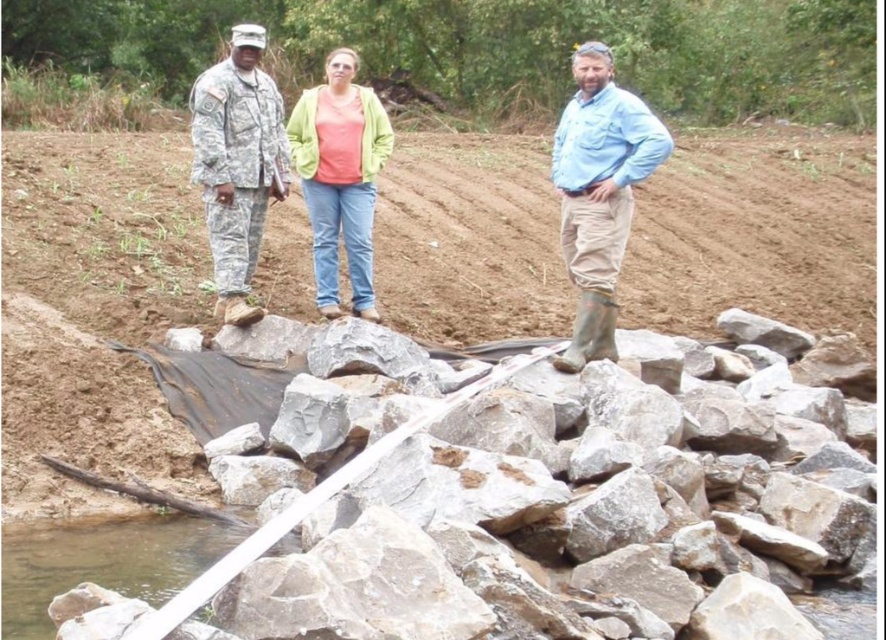
You are a construction worker standing at the edge of the construction site. You need to place a heavy tool on the closest object to you between the gray rough rock at center and the clear water at lower left. Which object should you choose?

The gray rough rock at center is closer to the viewer than the clear water at lower left, so you should place the heavy tool on the gray rough rock at center.

You are a construction worker checking the site. You see the gray rough rock at center and the clear water at lower left. Which object is positioned higher relative to the other?

The gray rough rock at center is located above the clear water at lower left, so it is positioned higher.

You are a safety inspector at the construction site. You need to ensure that the camouflage fabric uniform at center is kept at least 3 meters away from the clear water at lower left to prevent contamination. Based on the scene, is the current distance compliant with the safety regulation?

The camouflage fabric uniform at center is 3.12 meters away from the clear water at lower left, which meets the requirement of being at least 3 meters away. Therefore, the current distance is compliant with the safety regulation.